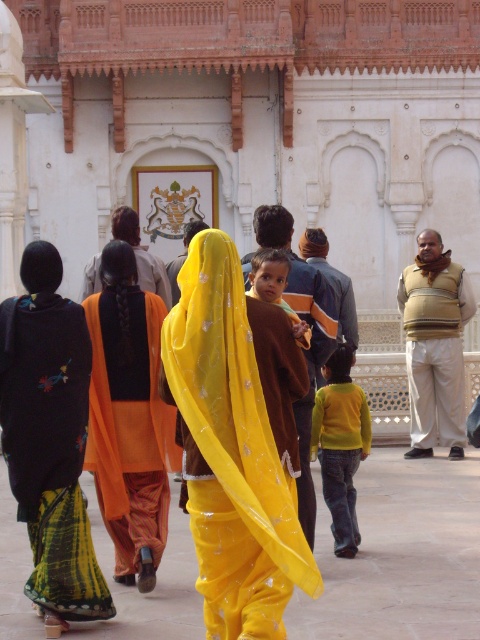
Question: Can you confirm if yellow satin sari at center is bigger than beige textured vest at center?

Choices:
 (A) no
 (B) yes

Answer: (B)

Question: Considering the relative positions of black embroidered sari at left and yellow-green sweater at center in the image provided, where is black embroidered sari at left located with respect to yellow-green sweater at center?

Choices:
 (A) below
 (B) above

Answer: (A)

Question: Estimate the real-world distances between objects in this image. Which object is farther from the black embroidered sari at left?

Choices:
 (A) matte brown shirt at center
 (B) yellow satin sari at center

Answer: (A)

Question: In this image, where is black embroidered sari at left located relative to beige textured vest at center?

Choices:
 (A) right
 (B) left

Answer: (B)

Question: Based on their relative distances, which object is farther from the beige textured vest at center?

Choices:
 (A) yellow-green sweater at center
 (B) matte brown shirt at center
 (C) orange fabric dress at center

Answer: (C)

Question: Estimate the real-world distances between objects in this image. Which object is farther from the matte brown shirt at center?

Choices:
 (A) orange fabric dress at center
 (B) yellow satin sari at center
 (C) beige textured vest at center
 (D) yellow-green sweater at center

Answer: (C)